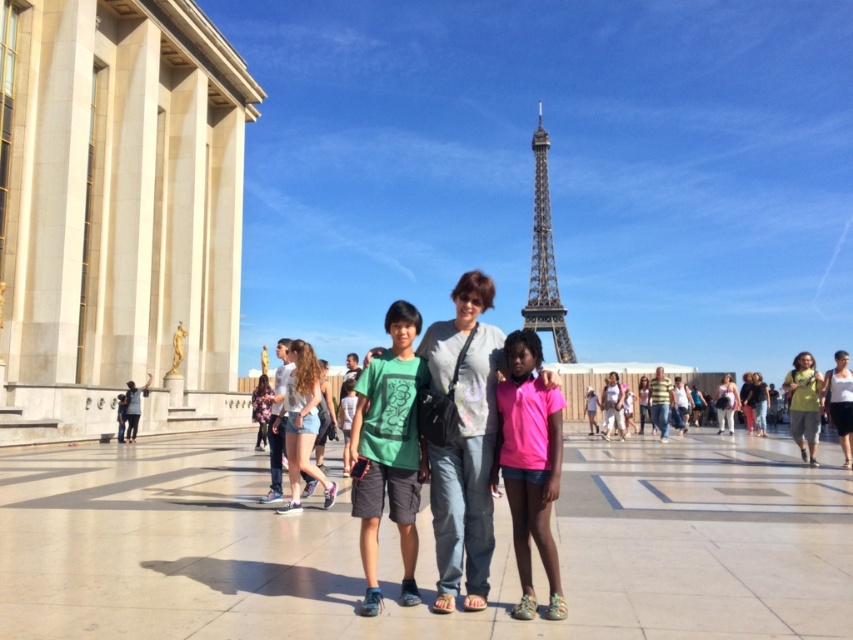
Is point (314, 368) positioned after point (660, 435)?

No, it is in front of (660, 435).

Does point (293, 508) lie in front of point (660, 394)?

Yes, it is in front of point (660, 394).

I want to click on denim shorts at lower left, so click(302, 422).

Locate an element on the screen. The image size is (853, 640). denim shorts at lower left is located at coordinates tap(302, 422).

Is light gray cotton shirt at center positioned before light yellow fabric dress at center?

Yes, light gray cotton shirt at center is in front of light yellow fabric dress at center.

In the scene shown: Is light gray cotton shirt at center smaller than light yellow fabric dress at center?

No, light gray cotton shirt at center is not smaller than light yellow fabric dress at center.

Between point (440, 456) and point (845, 394), which one is positioned in front?

Point (440, 456) is in front.

Locate an element on the screen. The height and width of the screenshot is (640, 853). light gray cotton shirt at center is located at coordinates (463, 442).

In the scene shown: Between light gray cotton shirt at center and green matte t-shirt at center, which one is positioned lower?

green matte t-shirt at center is lower down.

Does light gray cotton shirt at center lie behind green matte t-shirt at center?

That is True.

Between point (486, 426) and point (393, 481), which one is positioned in front?

Point (393, 481)

The width and height of the screenshot is (853, 640). I want to click on light gray cotton shirt at center, so click(463, 442).